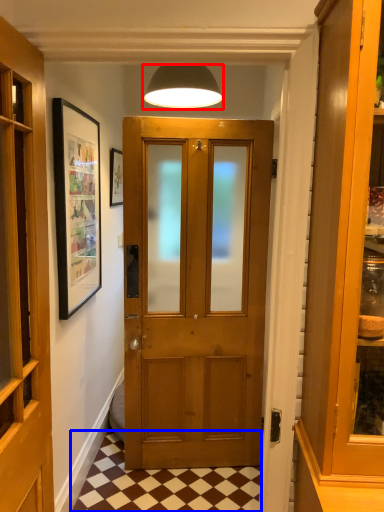
Question: Which point is further to the camera, lamp (highlighted by a red box) or tile (highlighted by a blue box)?

Choices:
 (A) lamp
 (B) tile

Answer: (A)